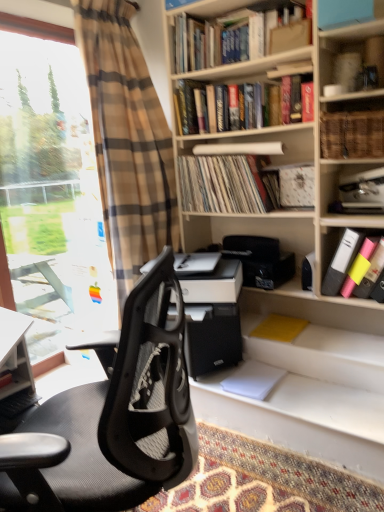
What are the coordinates of `free space above white paper at lower center, which appears as the first paperback book when ordered from the bottom (from a real-world perspective)` in the screenshot? It's located at (251, 377).